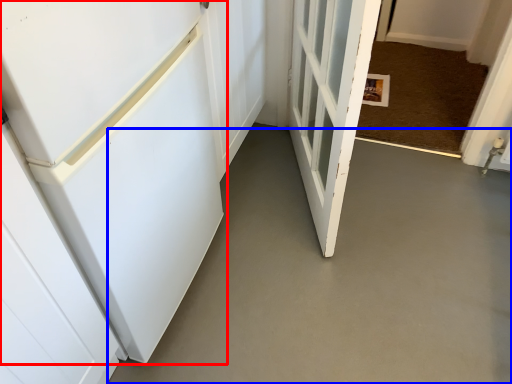
Question: Which of the following is the closest to the observer, door (highlighted by a red box) or concrete (highlighted by a blue box)?

Choices:
 (A) door
 (B) concrete

Answer: (B)